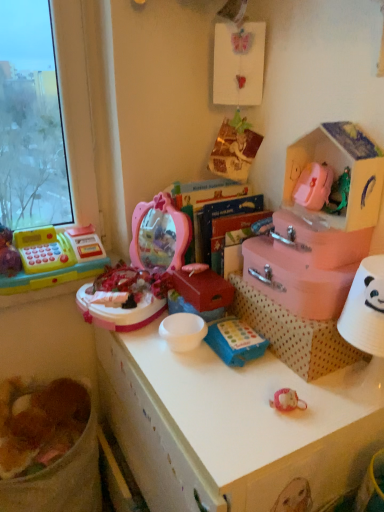
Question: Considering the relative positions of pink cardboard storage box at upper right and matte plastic cash register at left, the second toy from the bottom, in the image provided, is pink cardboard storage box at upper right to the left or to the right of matte plastic cash register at left, the second toy from the bottom,?

Choices:
 (A) right
 (B) left

Answer: (A)

Question: From their relative heights in the image, would you say pink cardboard storage box at upper right is taller or shorter than matte plastic cash register at left, marked as the 1th toy in a back-to-front arrangement?

Choices:
 (A) short
 (B) tall

Answer: (B)

Question: Considering the real-world distances, which object is farthest from the pink matte box at center-right, which appears as the second box when viewed from the right?

Choices:
 (A) pink cardboard storage box at upper right
 (B) brown crumbly food at lower left
 (C) matte plastic cash register at left, acting as the 1th toy starting from the top
 (D) blue fabric toy at center, which appears as the first toy when ordered from the bottom
 (E) polka dot cardboard box at center

Answer: (B)

Question: Which is nearer to the blue fabric toy at center, which ranks as the second toy in top-to-bottom order?

Choices:
 (A) pink matte box at center-right, which appears as the second box when viewed from the left
 (B) white plastic desk at center
 (C) pink cardboard storage box at upper right
 (D) polka dot cardboard box at center
 (E) matte pink box at center, placed as the third box when sorted from right to left

Answer: (D)